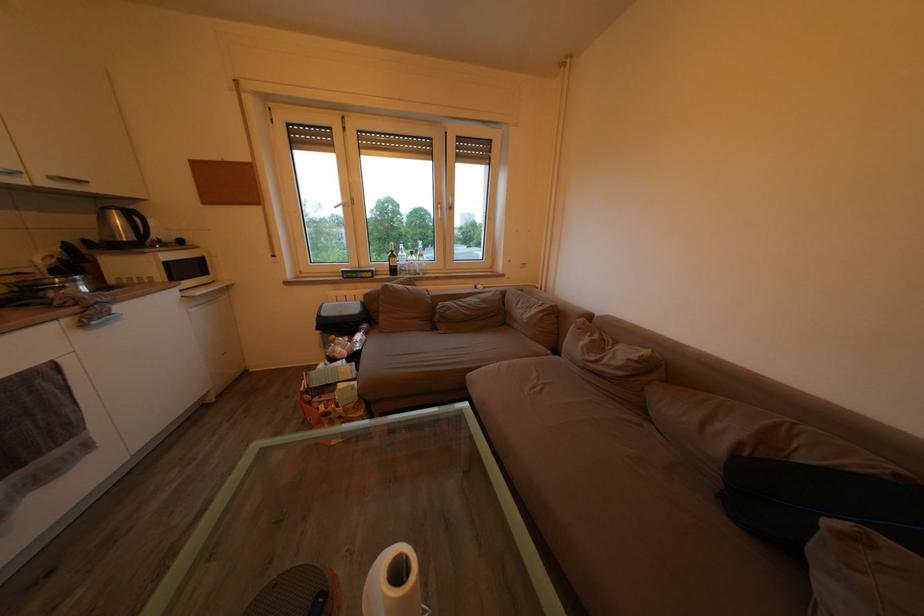
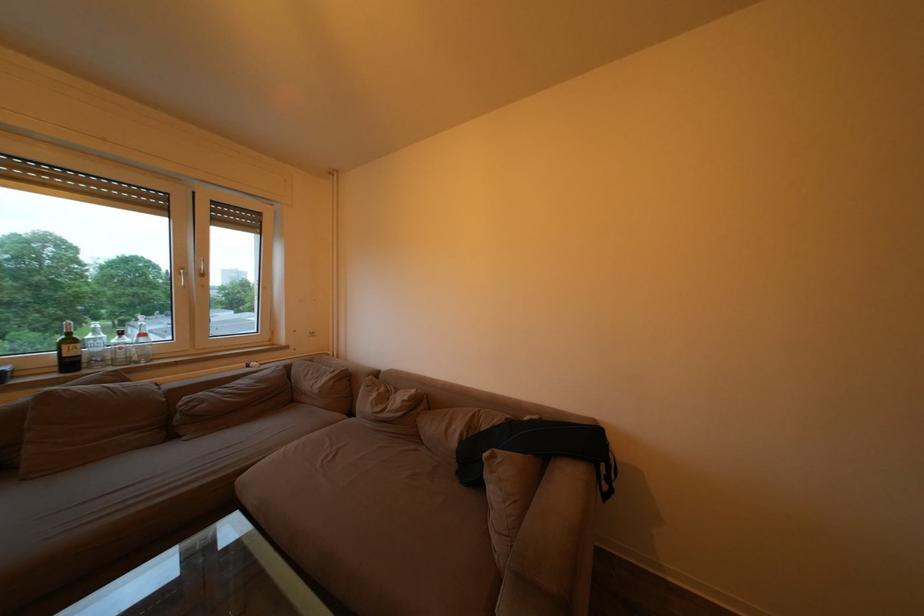
The point at (726, 455) is marked in the first image. Where is the corresponding point in the second image?

(463, 448)